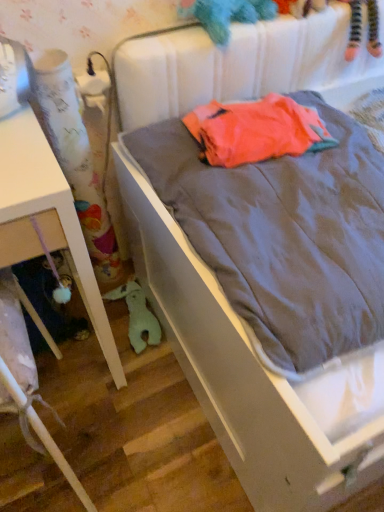
Find the location of a particular element. This screenshot has height=512, width=384. vacant area that is in front of green plush toy at lower left, which is the 2th toy from top to bottom is located at coordinates (123, 384).